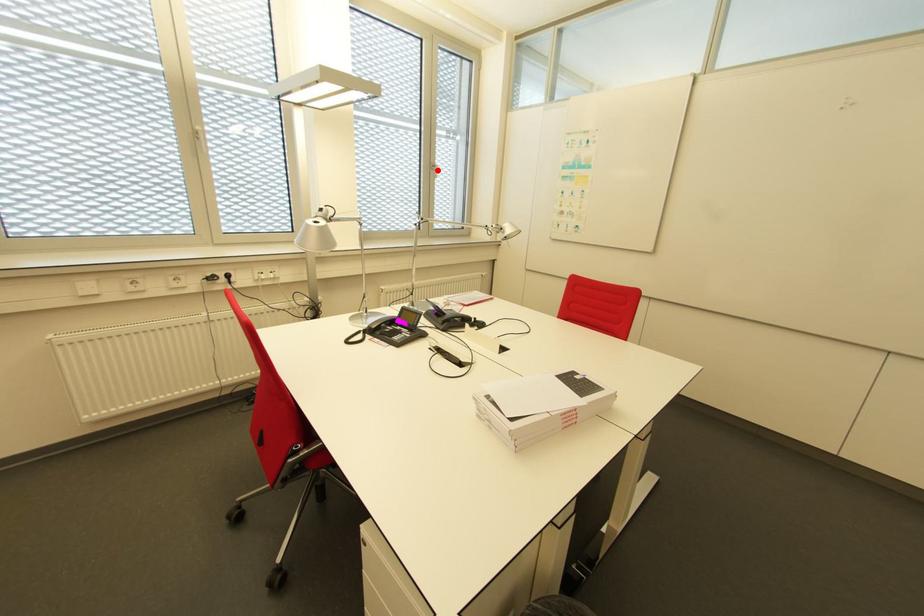
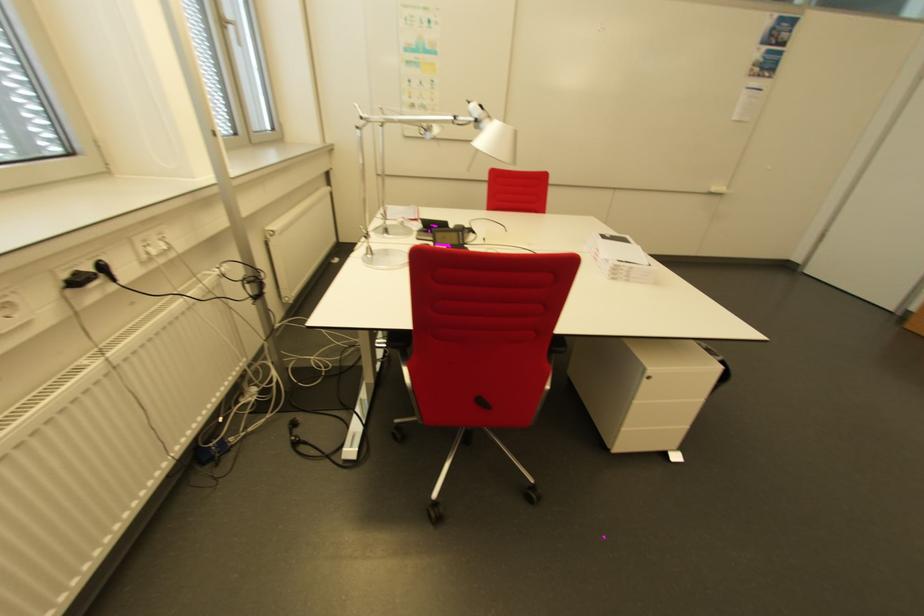
Question: I am providing you with two images of the same scene from different viewpoints. Given a red point in image1, look at the same physical point in image2. Is it:

Choices:
 (A) Closer to the viewpoint
 (B) Farther from the viewpoint

Answer: (B)